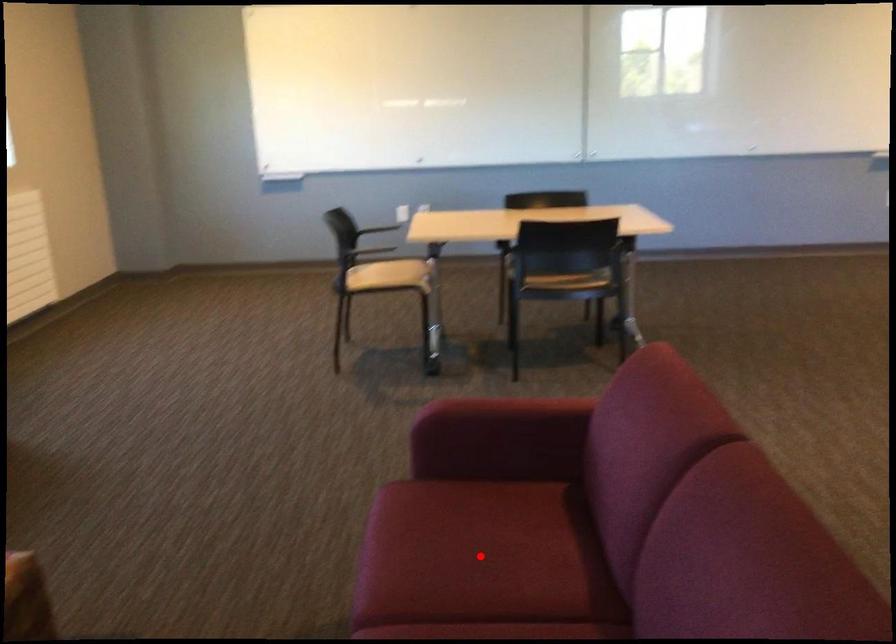
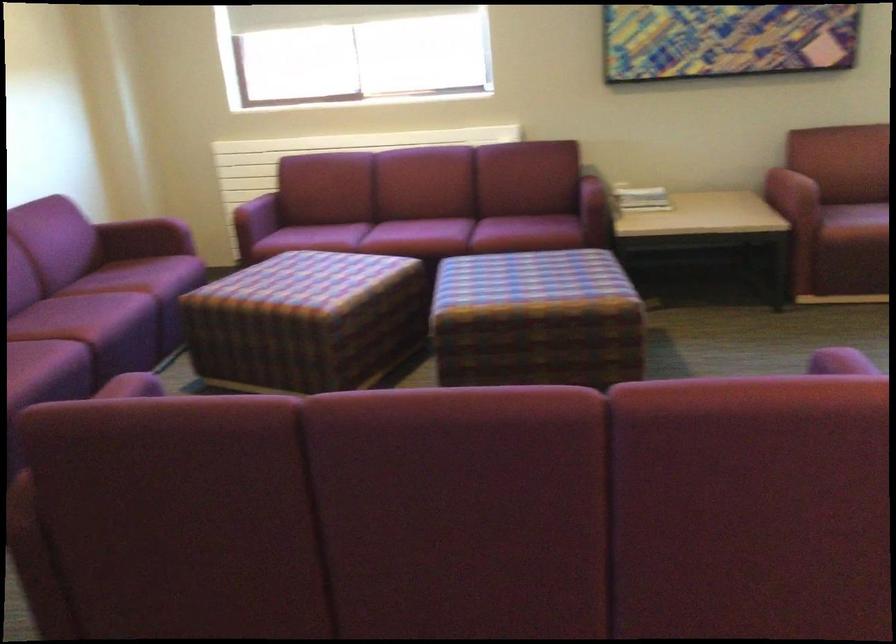
Question: I am providing you with two images of the same scene from different viewpoints. A red point is marked on the first image. Can you still see the location of the red point in image 2?

Choices:
 (A) Yes
 (B) No

Answer: (B)